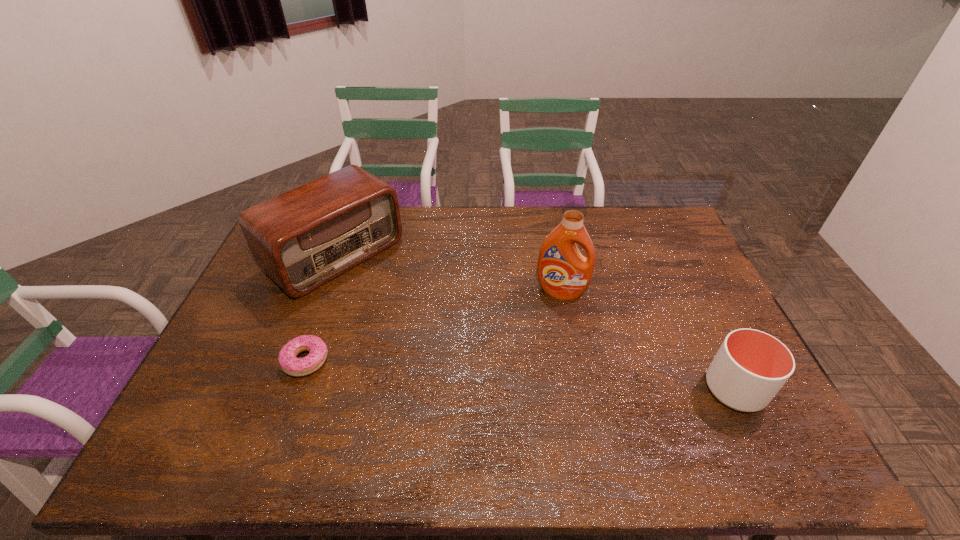
Find the location of a particular element. The width and height of the screenshot is (960, 540). vacant space on the desktop that is between the shortest object and the cup and is positioned on the front-facing side of the third object from left to right is located at coordinates (544, 376).

Where is `free spot on the desktop that is between the shortest object and the cup and is positioned on the front panel of the radio receiver`? The width and height of the screenshot is (960, 540). free spot on the desktop that is between the shortest object and the cup and is positioned on the front panel of the radio receiver is located at coordinates (481, 372).